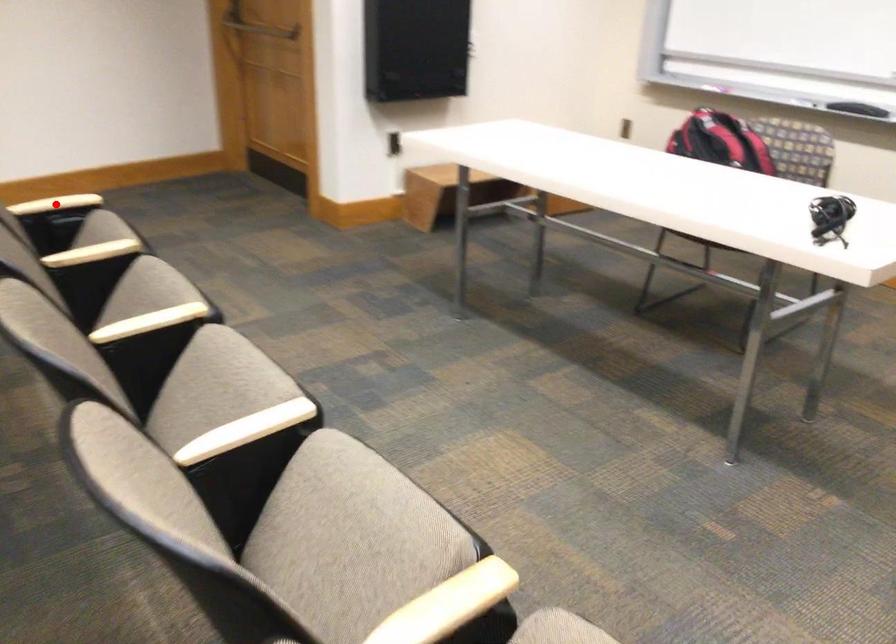
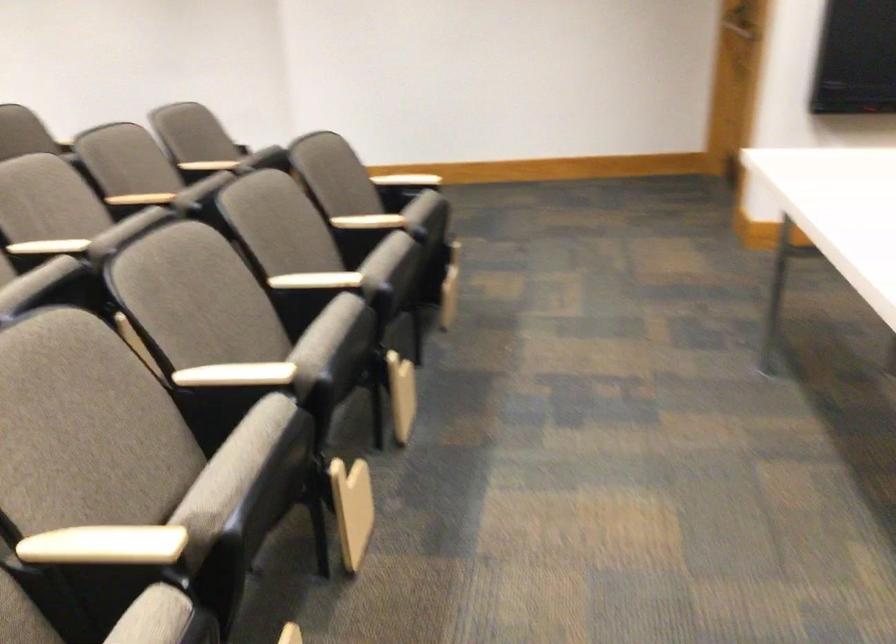
Question: I am providing you with two images of the same scene from different viewpoints. A red point is marked on the first image. Is the red point's position out of view in image 2?

Choices:
 (A) Yes
 (B) No

Answer: (A)